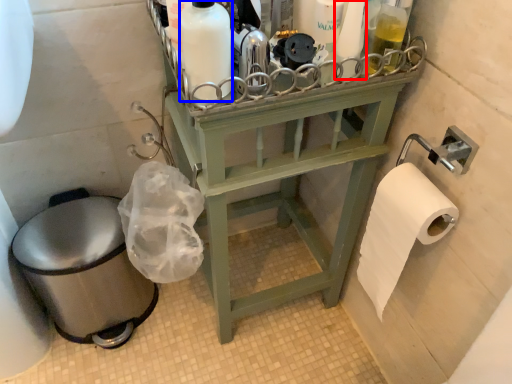
Question: Which object is further to the camera taking this photo, toiletry (highlighted by a red box) or cleaning product (highlighted by a blue box)?

Choices:
 (A) toiletry
 (B) cleaning product

Answer: (A)